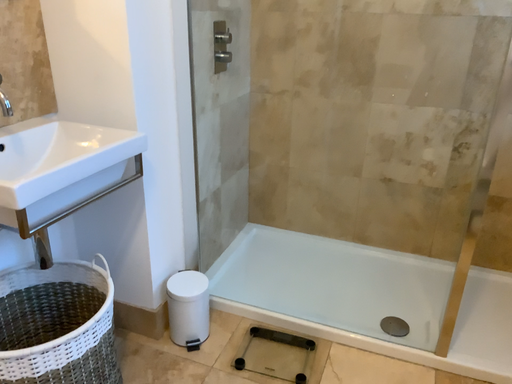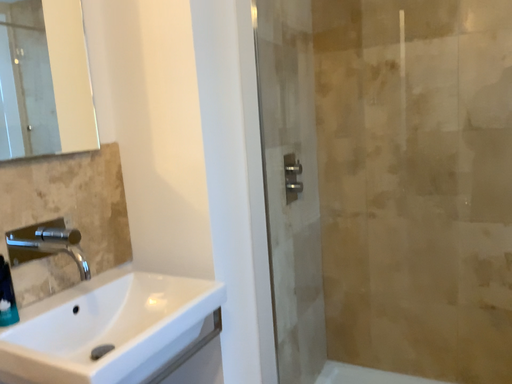
Question: How did the camera likely rotate when shooting the video?

Choices:
 (A) rotated downward
 (B) rotated upward

Answer: (B)